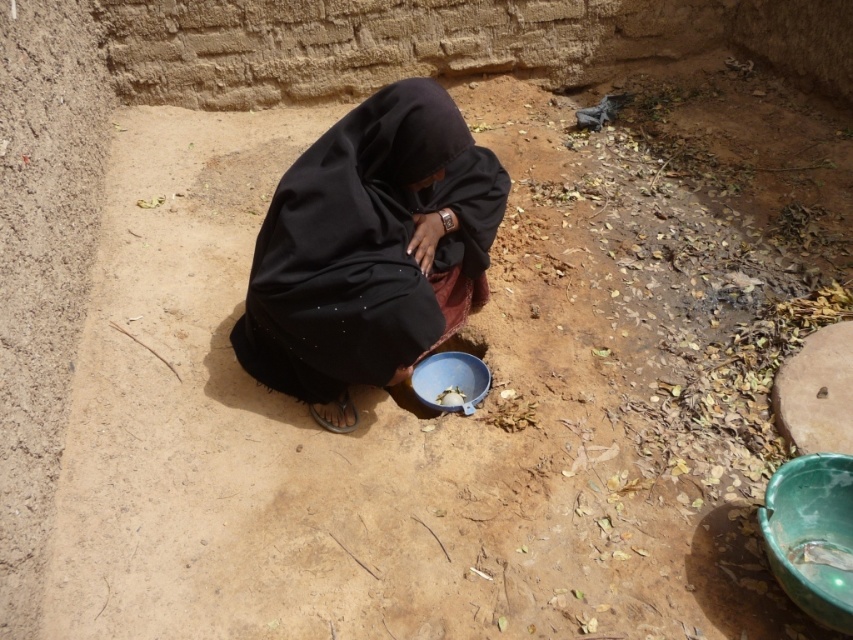
This screenshot has width=853, height=640. What do you see at coordinates (370, 250) in the screenshot?
I see `black matte dress at center` at bounding box center [370, 250].

Can you confirm if black matte dress at center is positioned to the left of green glossy bowl at lower right?

Yes, black matte dress at center is to the left of green glossy bowl at lower right.

What do you see at coordinates (370, 250) in the screenshot? This screenshot has width=853, height=640. I see `black matte dress at center` at bounding box center [370, 250].

At what (x,y) coordinates should I click in order to perform the action: click on black matte dress at center. Please return your answer as a coordinate pair (x, y). Looking at the image, I should click on (370, 250).

Describe the element at coordinates (370, 250) in the screenshot. The width and height of the screenshot is (853, 640). I see `black matte dress at center` at that location.

Is point (338, 200) more distant than point (415, 392)?

No, it is not.

Which is in front, point (386, 326) or point (440, 376)?

Point (386, 326)

Where is `black matte dress at center`? This screenshot has height=640, width=853. black matte dress at center is located at coordinates (370, 250).

Looking at this image, does green glossy bowl at lower right have a smaller size compared to blue plastic bowl at center?

Incorrect, green glossy bowl at lower right is not smaller in size than blue plastic bowl at center.

Is green glossy bowl at lower right positioned behind blue plastic bowl at center?

No, green glossy bowl at lower right is in front of blue plastic bowl at center.

Between point (775, 484) and point (480, 371), which one is positioned in front?

Point (775, 484)

Where is `green glossy bowl at lower right`? This screenshot has width=853, height=640. green glossy bowl at lower right is located at coordinates (811, 532).